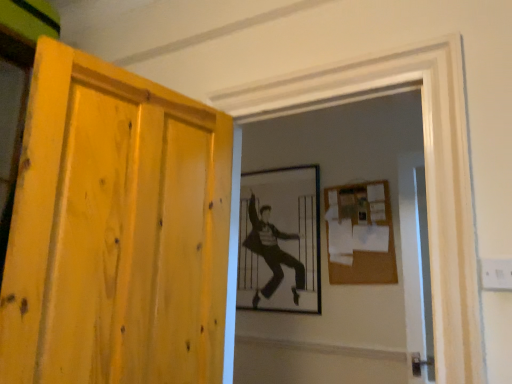
Question: Can you confirm if transparent glass screen door at right is thinner than black and white photograph of a man at center?

Choices:
 (A) no
 (B) yes

Answer: (A)

Question: Could you tell me if transparent glass screen door at right is facing black and white photograph of a man at center?

Choices:
 (A) yes
 (B) no

Answer: (B)

Question: Is transparent glass screen door at right bigger than black and white photograph of a man at center?

Choices:
 (A) no
 (B) yes

Answer: (A)

Question: Can you see transparent glass screen door at right touching black and white photograph of a man at center?

Choices:
 (A) no
 (B) yes

Answer: (A)

Question: From the image's perspective, is transparent glass screen door at right beneath black and white photograph of a man at center?

Choices:
 (A) no
 (B) yes

Answer: (B)

Question: Relative to yellow wood door at left, is burlap-like brown bulletin board at upper right in front or behind?

Choices:
 (A) front
 (B) behind

Answer: (B)

Question: In terms of height, does burlap-like brown bulletin board at upper right look taller or shorter compared to yellow wood door at left?

Choices:
 (A) tall
 (B) short

Answer: (B)

Question: From a real-world perspective, is burlap-like brown bulletin board at upper right above or below yellow wood door at left?

Choices:
 (A) above
 (B) below

Answer: (A)

Question: Considering the positions of burlap-like brown bulletin board at upper right and yellow wood door at left in the image, is burlap-like brown bulletin board at upper right wider or thinner than yellow wood door at left?

Choices:
 (A) thin
 (B) wide

Answer: (A)

Question: Is point (154, 178) closer or farther from the camera than point (425, 261)?

Choices:
 (A) farther
 (B) closer

Answer: (B)

Question: Is yellow wood door at left inside or outside of transparent glass screen door at right?

Choices:
 (A) inside
 (B) outside

Answer: (B)

Question: In terms of size, does yellow wood door at left appear bigger or smaller than transparent glass screen door at right?

Choices:
 (A) big
 (B) small

Answer: (A)

Question: In terms of height, does yellow wood door at left look taller or shorter compared to transparent glass screen door at right?

Choices:
 (A) short
 (B) tall

Answer: (A)

Question: Would you say burlap-like brown bulletin board at upper right is to the left or to the right of black and white photograph of a man at center in the picture?

Choices:
 (A) right
 (B) left

Answer: (A)

Question: Choose the correct answer: Is burlap-like brown bulletin board at upper right inside black and white photograph of a man at center or outside it?

Choices:
 (A) outside
 (B) inside

Answer: (A)